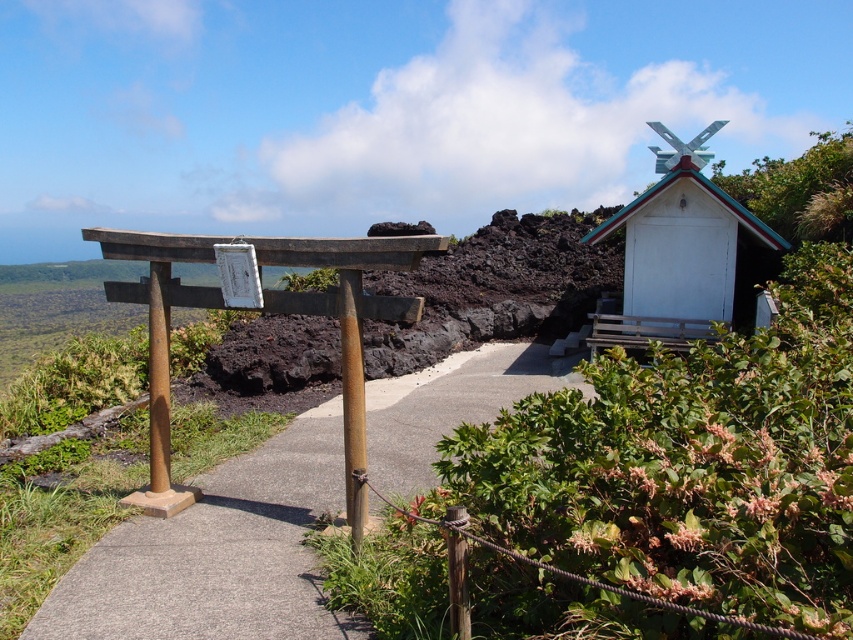
You are a landscape architect designing a new pathway. You need to know which object is wider between the concrete at center and the white wooden shrine at upper right. Which one is wider?

The concrete at center is wider than the white wooden shrine at upper right according to the description.

You are a visitor walking along the path in this Japanese garden scene. You see the concrete at center and the white wooden shrine at upper right. Which object is located to the left of the other?

The concrete at center is positioned on the left side of white wooden shrine at upper right.